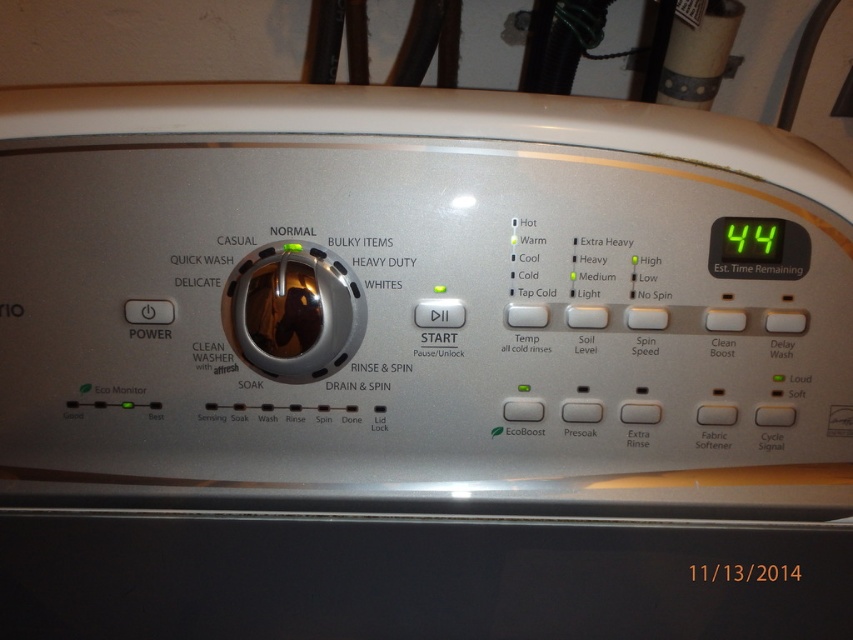
You are standing in front of the washing machine control panel. You see a point at coordinates (293, 310). What object is located at this point?

The point at coordinates (293, 310) corresponds to the satin silver knob at center.

You are standing in front of the washing machine and want to adjust the settings. Where is the satin silver knob at center located?

The satin silver knob at center is located at point (x=293, y=310).

You need to adjust the settings on the washing machine. If the satin silver knob at center and the green digital display at upper right are both in your line of sight, which one would you need to reach further to touch?

The satin silver knob at center is larger in width than the green digital display at upper right, so you would need to reach further to touch the satin silver knob at center since it is farther away from you.